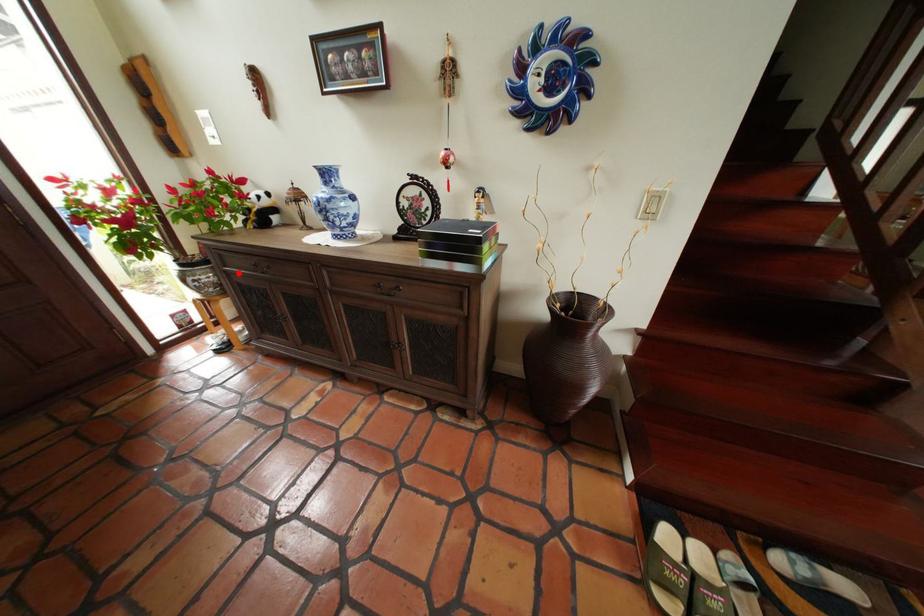
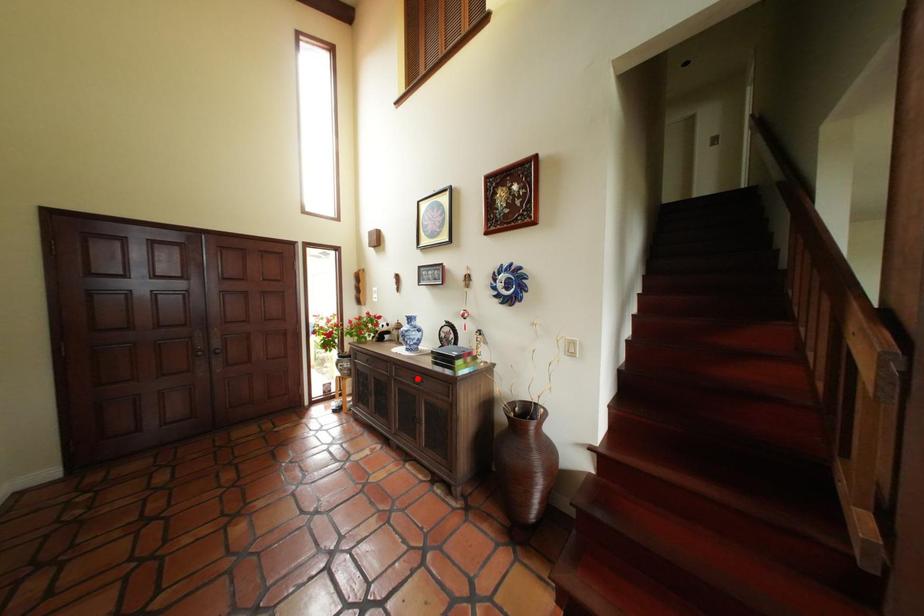
I am providing you with two images of the same scene from different viewpoints. A red point is marked on the first image and another point is marked on the second image. Are the points marked in image1 and image2 representing the same 3D position?

No